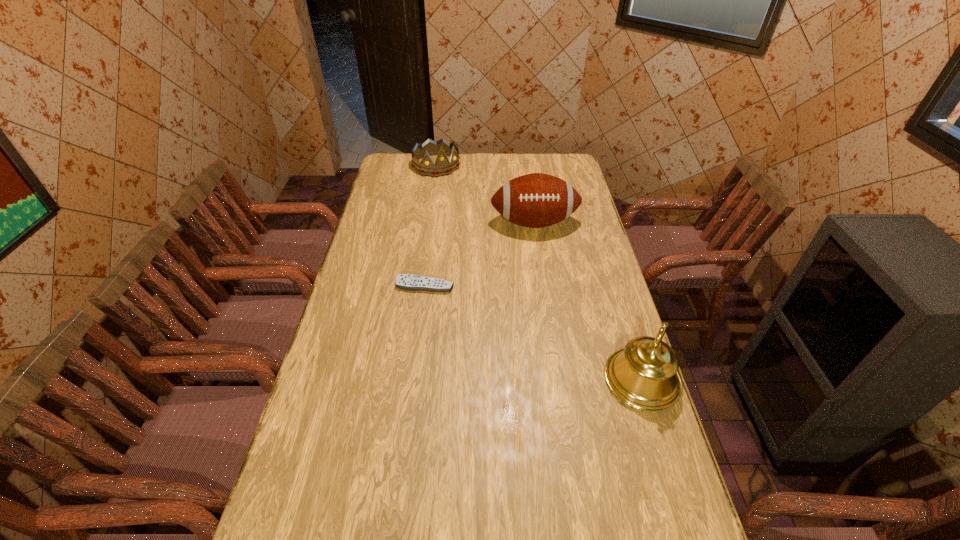
Locate an element on the screen. The image size is (960, 540). free space located at the front of the second shortest object with jewels is located at coordinates (450, 188).

What are the coordinates of `free spot located 0.170m on the laces of the third nearest object` in the screenshot? It's located at (542, 268).

Locate an element on the screen. vacant space located 0.230m on the laces of the third nearest object is located at coordinates (543, 279).

The width and height of the screenshot is (960, 540). Identify the location of vacant space situated 0.360m on the laces of the third nearest object. (548, 306).

The height and width of the screenshot is (540, 960). Find the location of `object present at the far edge`. object present at the far edge is located at coordinates (441, 148).

Identify the location of object that is at the left edge. This screenshot has width=960, height=540. (441, 148).

This screenshot has width=960, height=540. I want to click on bell that is at the right edge, so click(644, 375).

Locate an element on the screen. The height and width of the screenshot is (540, 960). football that is at the right edge is located at coordinates (535, 200).

Where is `object that is at the far left corner`? This screenshot has height=540, width=960. object that is at the far left corner is located at coordinates (441, 148).

The image size is (960, 540). Find the location of `free space at the far edge`. free space at the far edge is located at coordinates (511, 166).